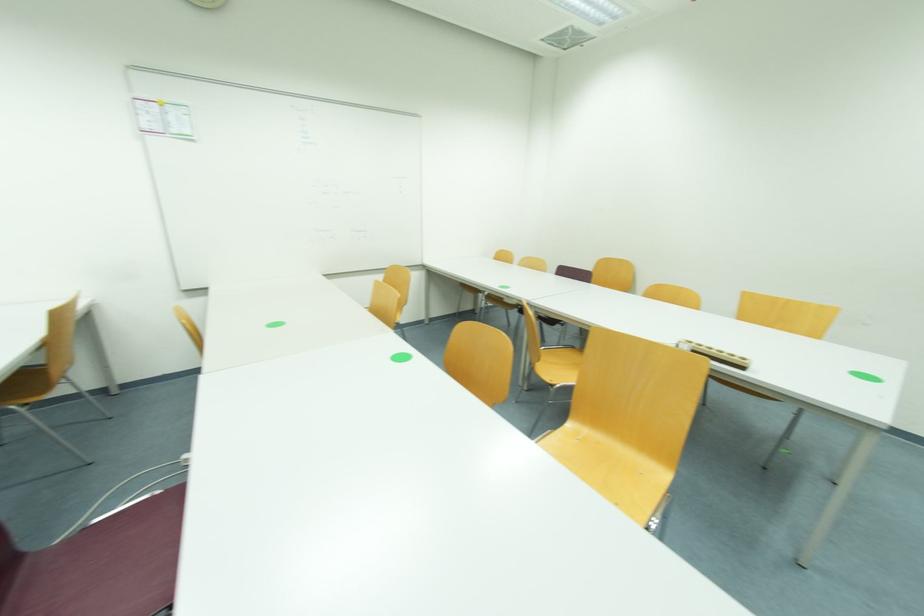
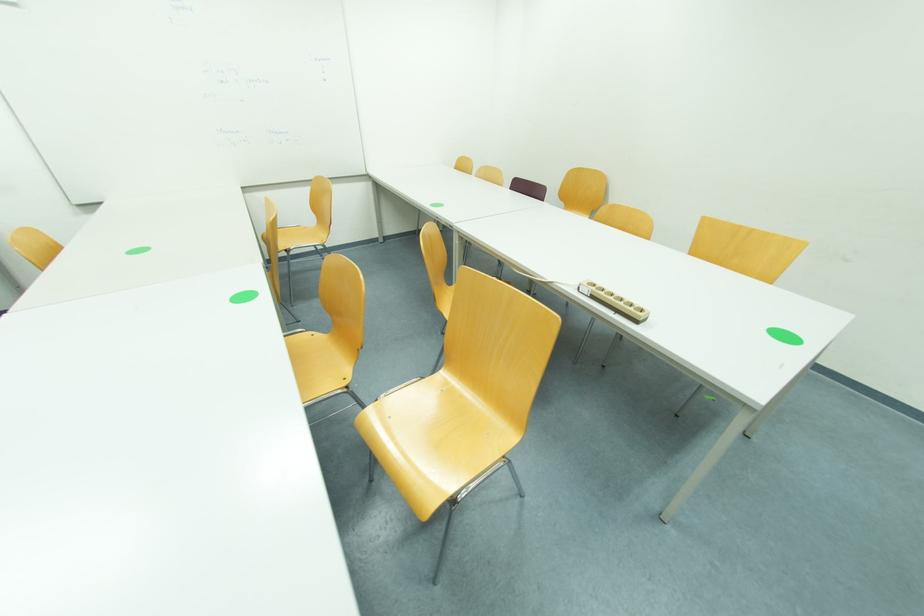
What movement of the cameraman would produce the second image?

The cameraman moved toward right, forward.